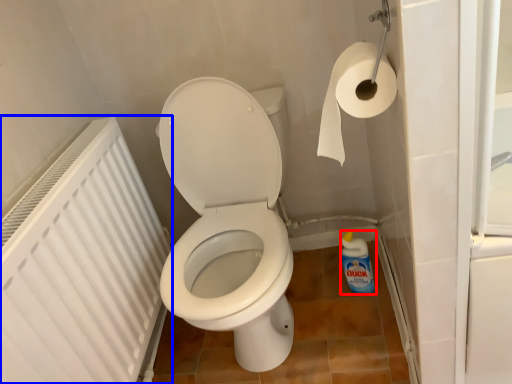
Question: Among these objects, which one is nearest to the camera, cleaning product (highlighted by a red box) or radiator (highlighted by a blue box)?

Choices:
 (A) cleaning product
 (B) radiator

Answer: (B)